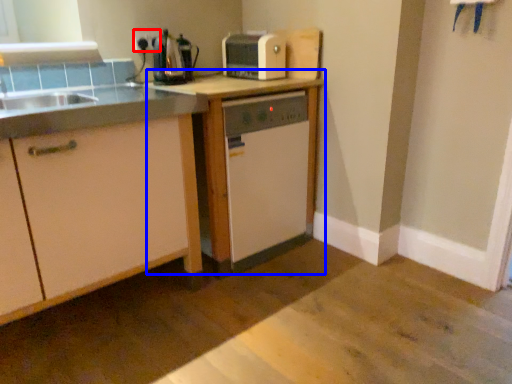
Question: Which point is closer to the camera, electric outlet (highlighted by a red box) or table (highlighted by a blue box)?

Choices:
 (A) electric outlet
 (B) table

Answer: (B)